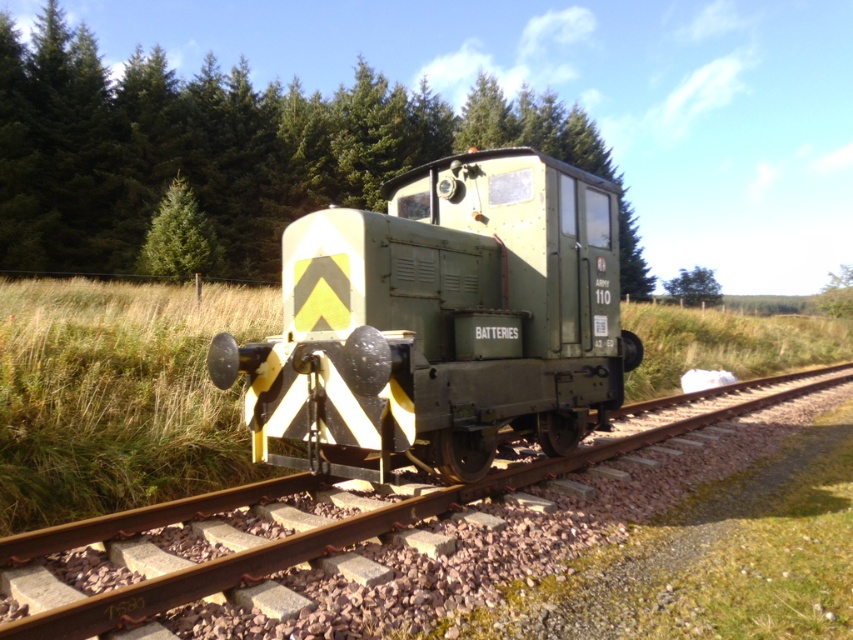
You are a maintenance worker needing to inspect the matte green train at center and the green textured tree at center. Given that your inspection equipment has a maximum range of 150 feet, can you effectively use it to check both objects without moving closer?

The distance between the matte green train at center and the green textured tree at center is 159.75 feet, which exceeds the equipment range of 150 feet. Therefore, you cannot effectively use the equipment to check both objects without moving closer.